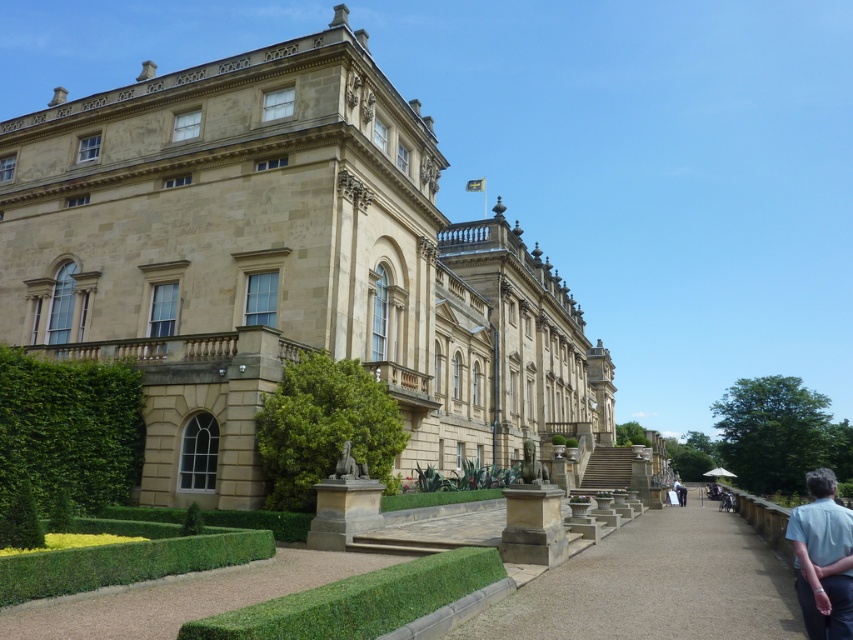
Question: Which of these objects is positioned farthest from the light blue shirt at lower right?

Choices:
 (A) beige stone palace at center
 (B) brown gravel path at center

Answer: (A)

Question: Where is beige stone palace at center located in relation to brown gravel path at center in the image?

Choices:
 (A) above
 (B) below

Answer: (A)

Question: Does green leafy hedge at lower left appear on the right side of light blue shirt at lower right?

Choices:
 (A) no
 (B) yes

Answer: (A)

Question: Which of the following is the closest to the observer?

Choices:
 (A) (802, 602)
 (B) (596, 600)
 (C) (265, 456)
 (D) (282, 113)

Answer: (A)

Question: Which object is closer to the camera taking this photo?

Choices:
 (A) beige stone palace at center
 (B) brown gravel path at center

Answer: (B)

Question: Is green leafy hedge at center below light blue shirt at lower right?

Choices:
 (A) no
 (B) yes

Answer: (A)